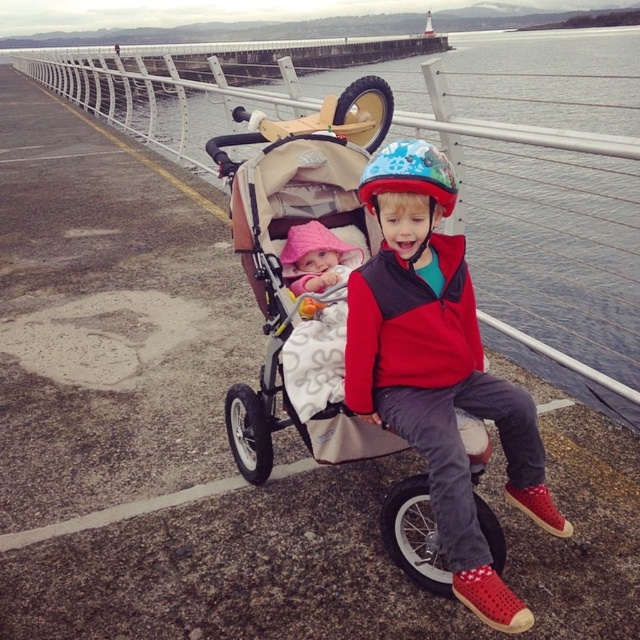
Is clear water at upper center behind red matte helmet at center?

That is True.

Does clear water at upper center have a lesser height compared to red matte helmet at center?

No.

The height and width of the screenshot is (640, 640). What do you see at coordinates (452, 156) in the screenshot?
I see `clear water at upper center` at bounding box center [452, 156].

Where is `clear water at upper center`? clear water at upper center is located at coordinates pos(452,156).

Can you confirm if red matte helmet at center is shorter than red fleece jacket at center?

Incorrect, red matte helmet at center's height does not fall short of red fleece jacket at center's.

Which is behind, point (433, 483) or point (388, 308)?

The point (388, 308) is behind.

Identify the location of red matte helmet at center. The width and height of the screenshot is (640, 640). (436, 369).

Between clear water at upper center and red fleece jacket at center, which one appears on the right side from the viewer's perspective?

red fleece jacket at center is more to the right.

Does clear water at upper center appear on the right side of red fleece jacket at center?

Incorrect, clear water at upper center is not on the right side of red fleece jacket at center.

Between point (540, 321) and point (388, 310), which one is positioned behind?

Point (540, 321)

Find the location of a particular element. This screenshot has width=640, height=640. clear water at upper center is located at coordinates (452, 156).